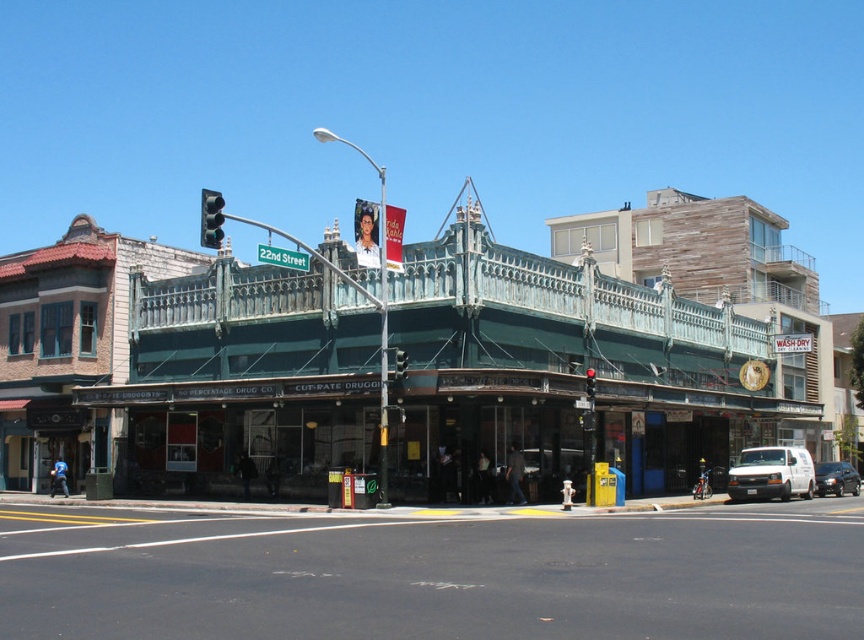
Is green glass traffic light at upper center to the right of red glass traffic light at upper center from the viewer's perspective?

In fact, green glass traffic light at upper center is to the left of red glass traffic light at upper center.

Is green glass traffic light at upper center further to the viewer compared to red glass traffic light at upper center?

No, green glass traffic light at upper center is closer to the viewer.

Is point (204, 200) farther from camera compared to point (585, 387)?

That is False.

Locate an element on the screen. green glass traffic light at upper center is located at coordinates (211, 218).

Which of these two, green glass traffic light at upper center or metallic traffic light at center, stands shorter?

Standing shorter between the two is metallic traffic light at center.

Does green glass traffic light at upper center have a larger size compared to metallic traffic light at center?

Correct, green glass traffic light at upper center is larger in size than metallic traffic light at center.

Is point (219, 205) less distant than point (404, 364)?

That is True.

Locate an element on the screen. green glass traffic light at upper center is located at coordinates (211, 218).

Can you confirm if green metal awning at center is positioned to the right of white matte van at center?

No, green metal awning at center is not to the right of white matte van at center.

Does point (106, 376) come in front of point (791, 477)?

No, (106, 376) is further to viewer.

Which is behind, point (469, 454) or point (799, 451)?

Positioned behind is point (799, 451).

Identify the location of green metal awning at center. This screenshot has width=864, height=640. (599, 356).